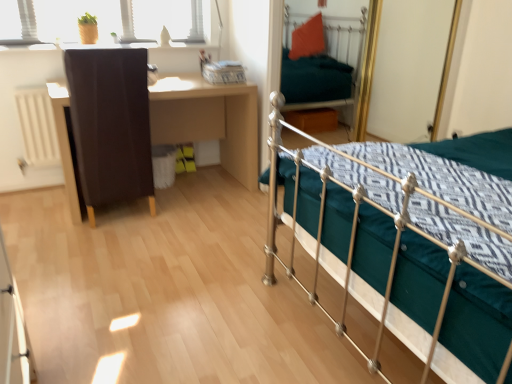
The image size is (512, 384). What do you see at coordinates (209, 120) in the screenshot?
I see `brown wooden desk at left` at bounding box center [209, 120].

Locate an element on the screen. The image size is (512, 384). metallic green bed at center is located at coordinates (399, 240).

Where is `brown wooden desk at left`? This screenshot has height=384, width=512. brown wooden desk at left is located at coordinates (209, 120).

Considering the relative sizes of brown wooden desk at left and matte brown cabinet at left in the image provided, is brown wooden desk at left wider than matte brown cabinet at left?

Yes.

Considering the points (239, 119) and (133, 137), which point is behind, point (239, 119) or point (133, 137)?

The point (239, 119) is behind.

Could you tell me if brown wooden desk at left is facing matte brown cabinet at left?

Yes, brown wooden desk at left is facing matte brown cabinet at left.

Considering the relative positions of brown wooden desk at left and metallic green bed at center in the image provided, is brown wooden desk at left to the left of metallic green bed at center from the viewer's perspective?

Indeed, brown wooden desk at left is positioned on the left side of metallic green bed at center.

From the picture: Which of these two, brown wooden desk at left or metallic green bed at center, is wider?

metallic green bed at center.

Is brown wooden desk at left turned away from metallic green bed at center?

No, brown wooden desk at left's orientation is not away from metallic green bed at center.

Does brown wooden desk at left contain metallic green bed at center?

No, metallic green bed at center is not surrounded by brown wooden desk at left.

From a real-world perspective, which is physically below, matte brown cabinet at left or metallic green bed at center?

matte brown cabinet at left.

Would you say matte brown cabinet at left is inside or outside metallic green bed at center?

matte brown cabinet at left cannot be found inside metallic green bed at center.

Is matte brown cabinet at left in contact with metallic green bed at center?

There is a gap between matte brown cabinet at left and metallic green bed at center.

Which object is closer to the camera, matte brown cabinet at left or metallic green bed at center?

metallic green bed at center.

From a real-world perspective, is metallic green bed at center located higher than matte brown cabinet at left?

Correct, in the physical world, metallic green bed at center is higher than matte brown cabinet at left.

From the image's perspective, is metallic green bed at center above or below matte brown cabinet at left?

metallic green bed at center is situated lower than matte brown cabinet at left in the image.

What are the coordinates of `bed below the matte brown cabinet at left (from the image's perspective)` in the screenshot? It's located at (399, 240).

Consider the image. Based on their sizes in the image, would you say metallic green bed at center is bigger or smaller than matte brown cabinet at left?

In the image, metallic green bed at center appears to be larger than matte brown cabinet at left.

In order to click on desk below the matte brown cabinet at left (from a real-world perspective) in this screenshot , I will do `click(209, 120)`.

From the picture: Based on their sizes in the image, would you say matte brown cabinet at left is bigger or smaller than brown wooden desk at left?

Clearly, matte brown cabinet at left is smaller in size than brown wooden desk at left.

In the image, is matte brown cabinet at left positioned in front of or behind brown wooden desk at left?

Clearly, matte brown cabinet at left is in front of brown wooden desk at left.

Is matte brown cabinet at left inside the boundaries of brown wooden desk at left, or outside?

matte brown cabinet at left is inside brown wooden desk at left.

Can you confirm if metallic green bed at center is positioned to the right of brown wooden desk at left?

Yes, metallic green bed at center is to the right of brown wooden desk at left.

In terms of width, does metallic green bed at center look wider or thinner when compared to brown wooden desk at left?

Clearly, metallic green bed at center has more width compared to brown wooden desk at left.

Consider the image. Who is smaller, metallic green bed at center or brown wooden desk at left?

Smaller between the two is brown wooden desk at left.

In the scene shown: Would you consider metallic green bed at center to be distant from brown wooden desk at left?

metallic green bed at center is positioned a significant distance from brown wooden desk at left.

I want to click on desk behind the matte brown cabinet at left, so (209, 120).

Where is `desk that appears above the metallic green bed at center (from the image's perspective)`? desk that appears above the metallic green bed at center (from the image's perspective) is located at coordinates (209, 120).

Considering their positions, is brown wooden desk at left positioned further to metallic green bed at center than matte brown cabinet at left?

Based on the image, brown wooden desk at left appears to be further to metallic green bed at center.

Based on their spatial positions, is metallic green bed at center or brown wooden desk at left closer to matte brown cabinet at left?

The object closer to matte brown cabinet at left is brown wooden desk at left.

Looking at the image, which one is located further to brown wooden desk at left, matte brown cabinet at left or metallic green bed at center?

metallic green bed at center.

Based on their spatial positions, is metallic green bed at center or matte brown cabinet at left further from brown wooden desk at left?

metallic green bed at center is positioned further to the anchor brown wooden desk at left.

Based on their spatial positions, is brown wooden desk at left or metallic green bed at center further from matte brown cabinet at left?

The object further to matte brown cabinet at left is metallic green bed at center.

Estimate the real-world distances between objects in this image. Which object is closer to metallic green bed at center, matte brown cabinet at left or brown wooden desk at left?

Based on the image, matte brown cabinet at left appears to be nearer to metallic green bed at center.

At what (x,y) coordinates should I click in order to perform the action: click on desk located between matte brown cabinet at left and metallic green bed at center in the left-right direction. Please return your answer as a coordinate pair (x, y). This screenshot has height=384, width=512. Looking at the image, I should click on (209, 120).